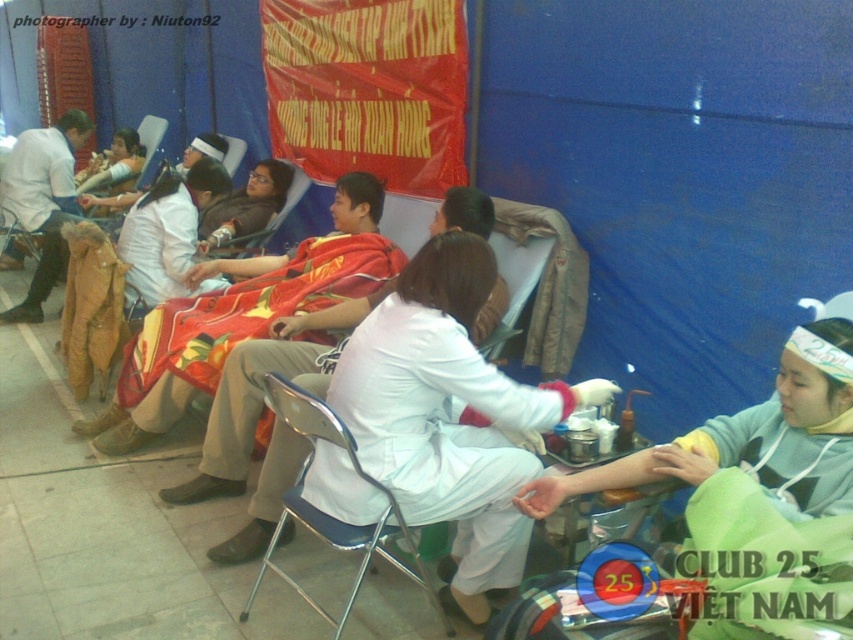
Question: Which point appears farthest from the camera in this image?

Choices:
 (A) (312, 387)
 (B) (450, 280)
 (C) (415, 544)
 (D) (310, 292)

Answer: (D)

Question: Estimate the real-world distances between objects in this image. Which object is closer to the metallic blue chair at center?

Choices:
 (A) matte white shirt at upper left
 (B) matte brown boots at left

Answer: (B)

Question: Is white matte uniform at center smaller than metallic blue chair at center?

Choices:
 (A) no
 (B) yes

Answer: (A)

Question: Which object appears closest to the camera in this image?

Choices:
 (A) metallic blue chair at center
 (B) white matte uniform at center
 (C) matte brown boots at left
 (D) reddish-brown fabric blanket at center

Answer: (A)

Question: Considering the relative positions of white matte shirt at center and matte black jacket at center in the image provided, where is white matte shirt at center located with respect to matte black jacket at center?

Choices:
 (A) right
 (B) left

Answer: (B)

Question: Is matte white coat at center below matte black jacket at center?

Choices:
 (A) no
 (B) yes

Answer: (B)